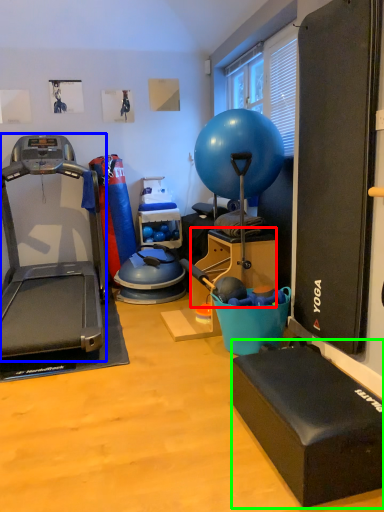
Question: Which object is positioned farthest from box (highlighted by a red box)? Select from treadmill (highlighted by a blue box) and box (highlighted by a green box).

Choices:
 (A) treadmill
 (B) box

Answer: (B)